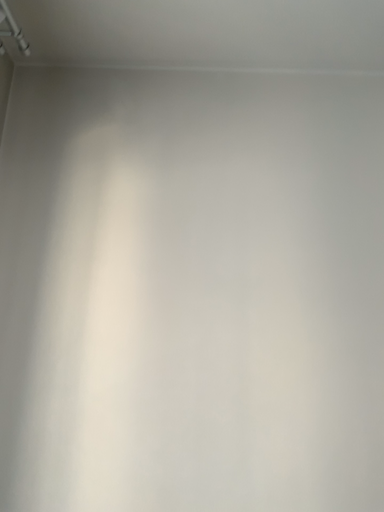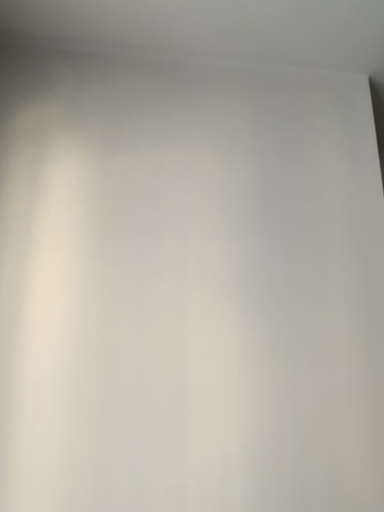
Question: How did the camera likely rotate when shooting the video?

Choices:
 (A) rotated left
 (B) rotated right

Answer: (B)